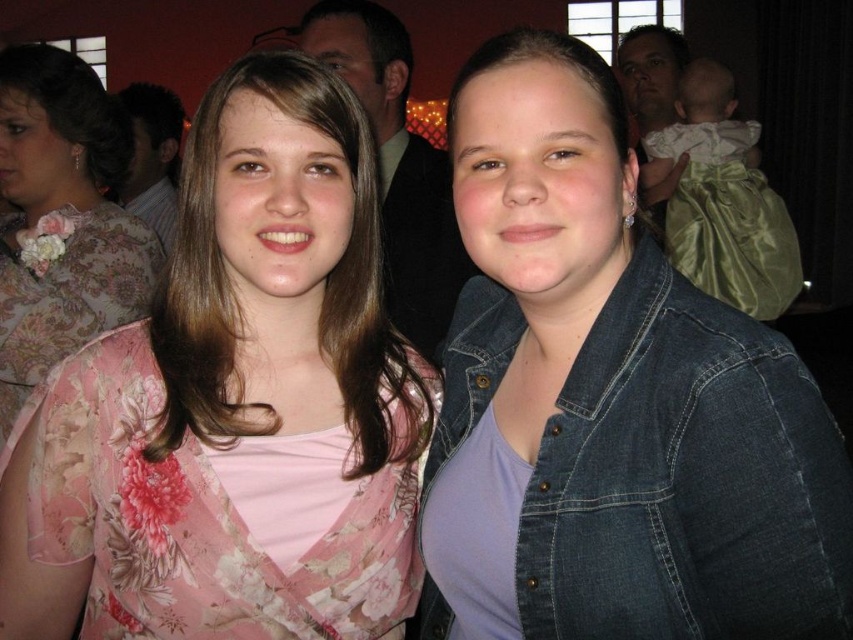
Looking at this image, you are at a social gathering and want to take a photo of the two points mentioned. Which point, point [117,636] or point [461,280], is closer to you?

Point [117,636] is closer to the viewer than point [461,280].

You are standing at the point marked as point (782,384) in the image. You want to move to the door located at the far end of the room. Considering your height is 5 feet, will you be able to see over the crowd to the door?

The point marked as point (782,384) is 3.94 feet away from the viewer. Since the viewer is 5 feet tall, they should be able to see over the crowd to the door located at the far end of the room.